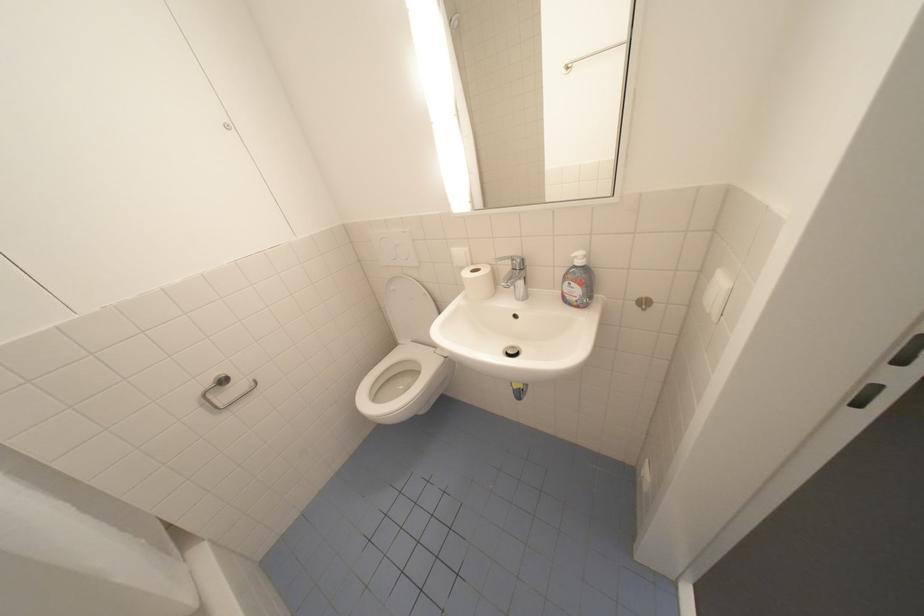
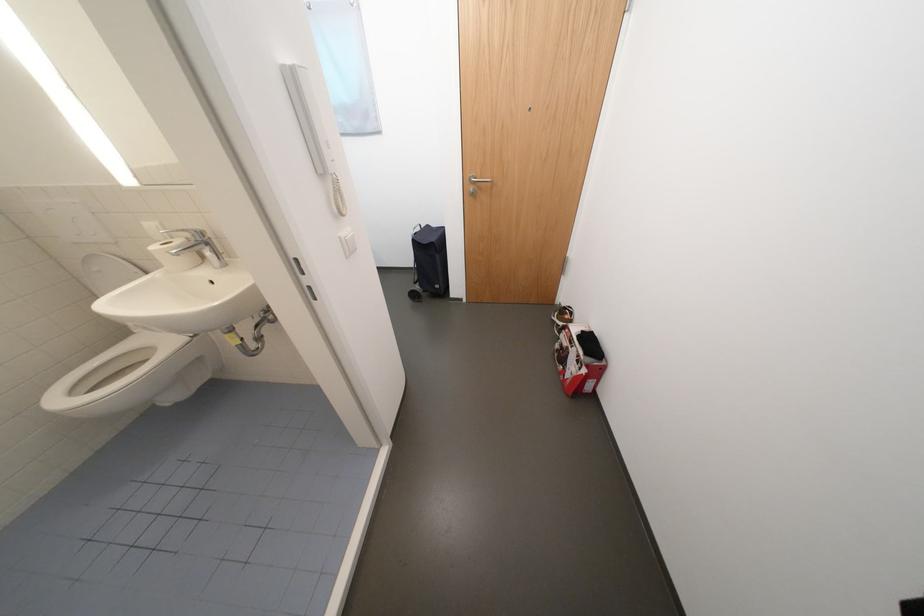
In the second image, find the point that corresponds to point 480,265 in the first image.

(179, 238)